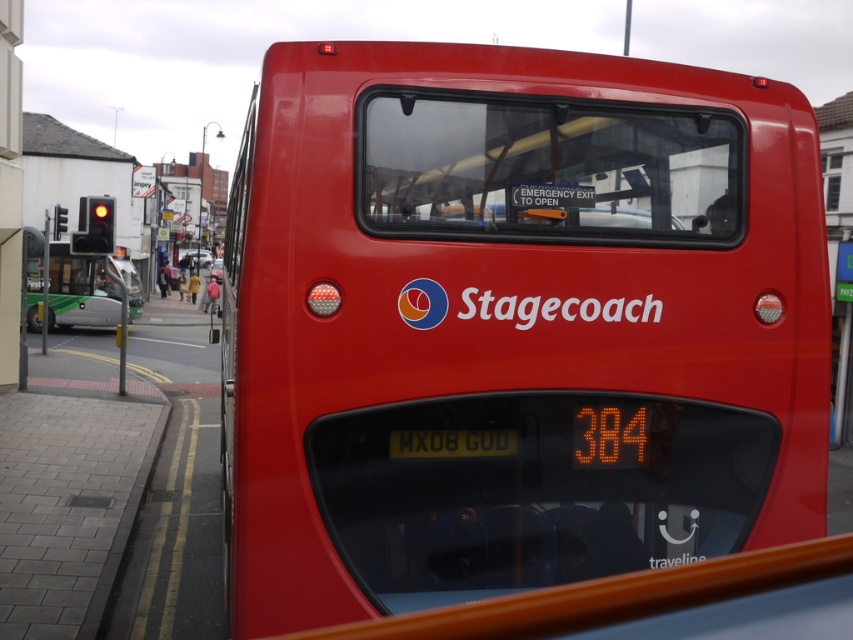
You are a pedestrian standing between two buses. The shiny red bus at center is in front of you, and the green metallic bus at left is behind you. You want to cross the road to a nearby coffee shop. Which bus is closer to you?

The shiny red bus at center is closer to you since it is in front of you, while the green metallic bus at left is behind you. The distance between them is 24.75 meters, so the shiny red bus at center is nearer.

You are a delivery person who needs to place a small package on the shiny red bus at center. The yellow metallic license plate at center is in the way. Can you place the package between them?

The shiny red bus at center and the yellow metallic license plate at center are 57.65 centimeters apart, so yes, you can place the package between them as there is enough space.

You are standing at the bus stop looking at the red Stagecoach bus and the green metallic bus at left. Which bus is closer to the left edge of the bus stop platform?

The green metallic bus at left is closer to the left edge of the bus stop platform because its 2D location is at point (80,289), which places it further left compared to the red Stagecoach bus.